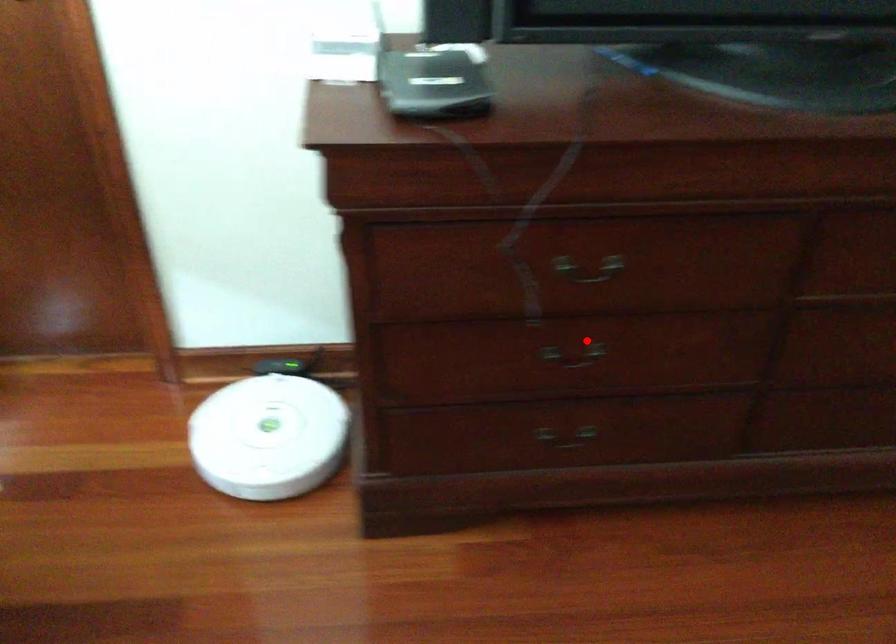
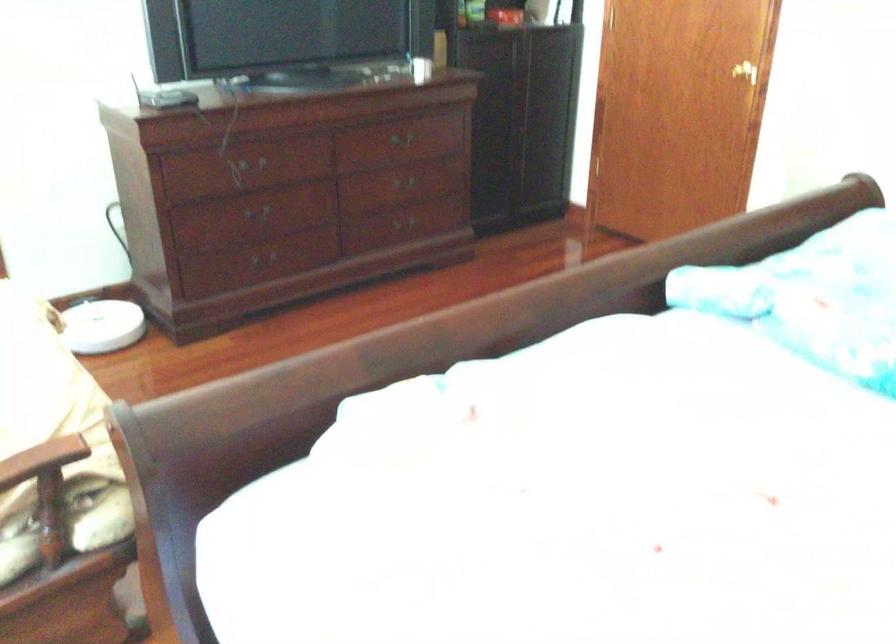
Locate, in the second image, the point that corresponds to the highlighted location in the first image.

(255, 210)